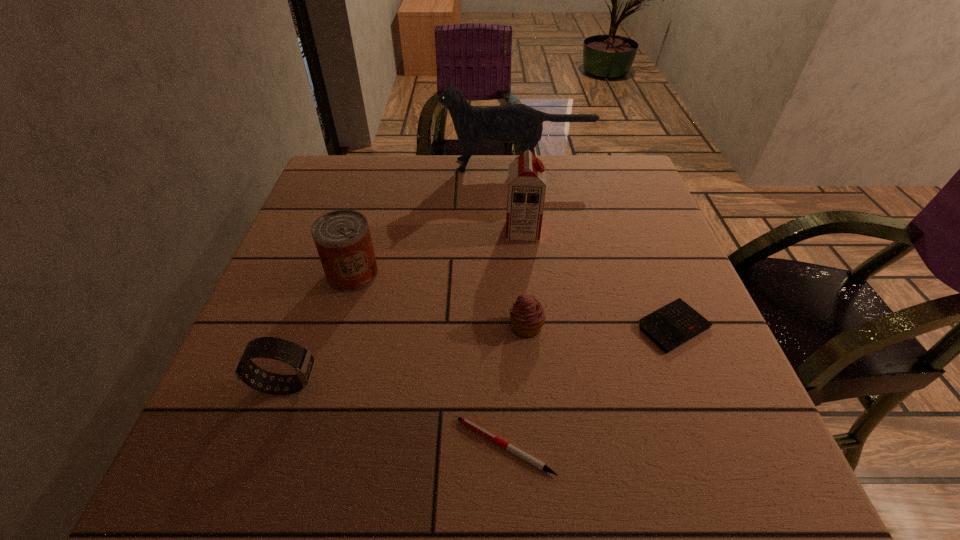
Where is `free region located 0.170m on the clicker of the nearest object`? Image resolution: width=960 pixels, height=540 pixels. free region located 0.170m on the clicker of the nearest object is located at coordinates (347, 447).

Locate an element on the screen. This screenshot has width=960, height=540. object present at the far edge is located at coordinates (516, 122).

Find the location of a particular element. object present at the near edge is located at coordinates (464, 421).

Find the location of a particular element. This screenshot has height=540, width=960. can situated at the left edge is located at coordinates (342, 237).

Identify the location of watch that is at the left edge. 300,358.

This screenshot has height=540, width=960. Identify the location of cat situated at the right edge. (516, 122).

The height and width of the screenshot is (540, 960). I want to click on calculator present at the right edge, so click(674, 324).

Find the location of a particular element. object present at the far right corner is located at coordinates (516, 122).

What are the coordinates of `vacant space at the far edge of the desktop` in the screenshot? It's located at (456, 173).

Where is `vacant space at the left edge of the desktop`? vacant space at the left edge of the desktop is located at coordinates (265, 413).